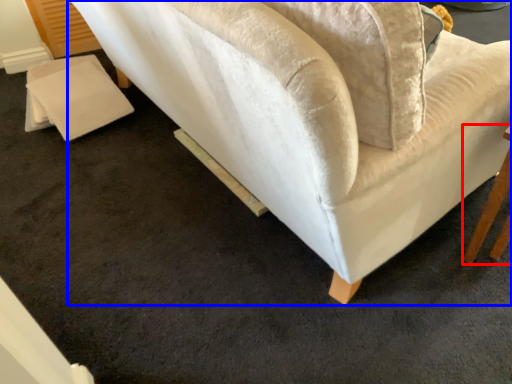
Question: Which point is further to the camera, table (highlighted by a red box) or studio couch (highlighted by a blue box)?

Choices:
 (A) table
 (B) studio couch

Answer: (A)